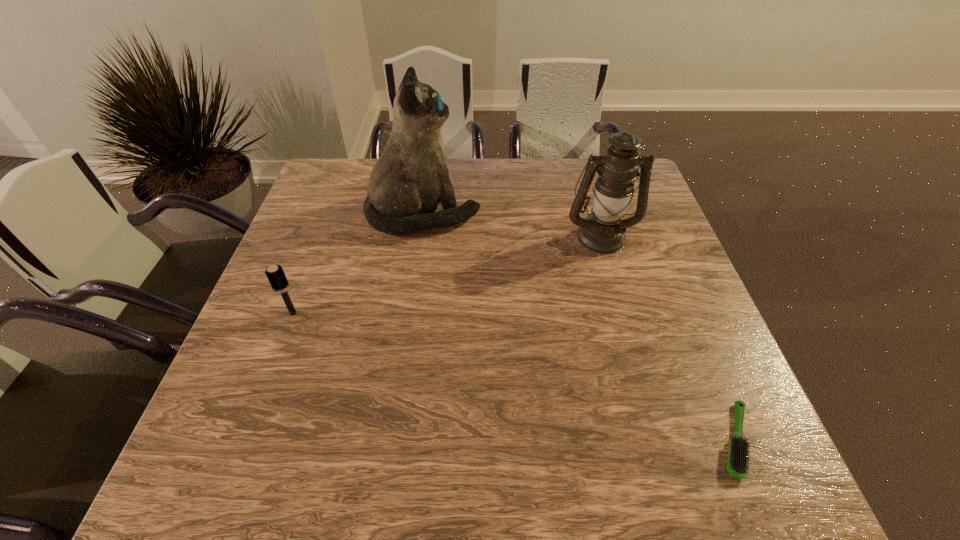
In order to click on free space at the right edge in this screenshot , I will do `click(723, 373)`.

Image resolution: width=960 pixels, height=540 pixels. I want to click on free space at the far left corner, so click(x=319, y=177).

Where is `free point between the third tallest object and the cat`? free point between the third tallest object and the cat is located at coordinates (358, 264).

Identify the location of free space that is in between the second tallest object and the left hairbrush. Image resolution: width=960 pixels, height=540 pixels. (447, 274).

What are the coordinates of `vacant space in between the right hairbrush and the tallest object` in the screenshot? It's located at (579, 327).

The image size is (960, 540). Identify the location of free space between the cat and the nearer hairbrush. (579, 327).

Where is `free space between the nearer hairbrush and the left hairbrush`? This screenshot has width=960, height=540. free space between the nearer hairbrush and the left hairbrush is located at coordinates (515, 376).

In order to click on vacant space that's between the third object from right to left and the nearer hairbrush in this screenshot , I will do `click(579, 327)`.

I want to click on free space between the leftmost object and the third shortest object, so click(x=447, y=274).

The image size is (960, 540). What are the coordinates of `free space between the second tallest object and the cat` in the screenshot? It's located at tap(513, 225).